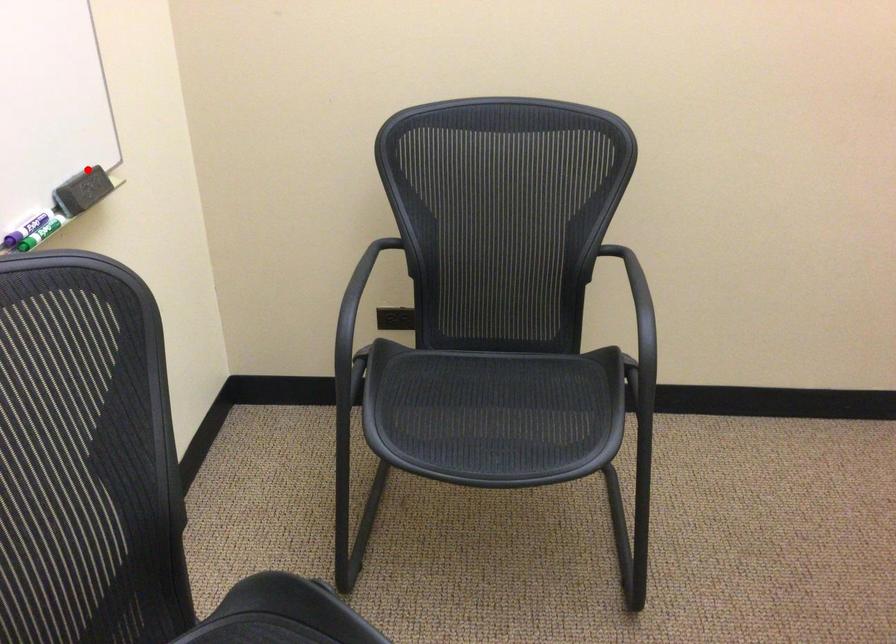
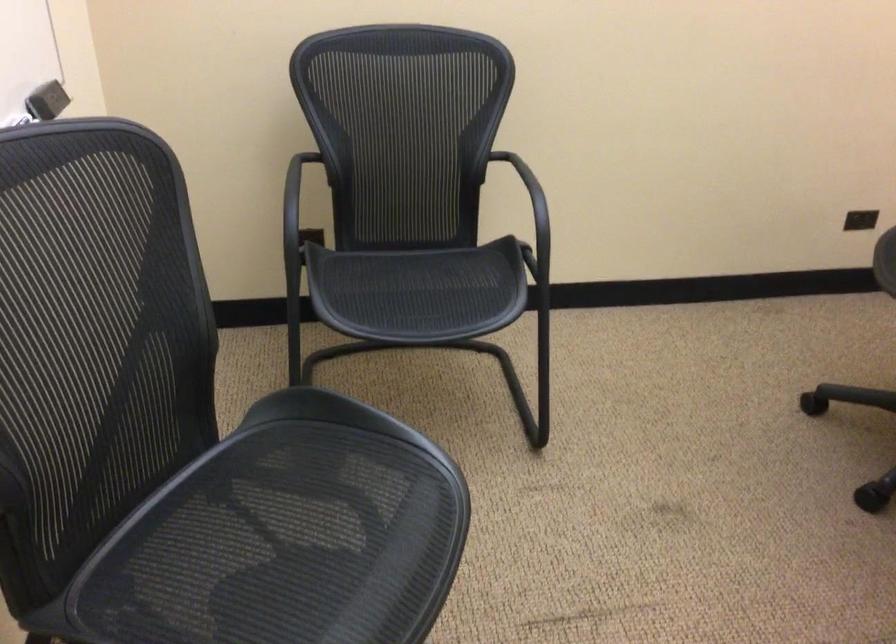
Question: I am providing you with two images of the same scene from different viewpoints. Image1 has a red point marked. In image2, the corresponding 3D location appears at what relative position? Reply with the corresponding letter.

Choices:
 (A) Closer
 (B) Farther

Answer: (B)